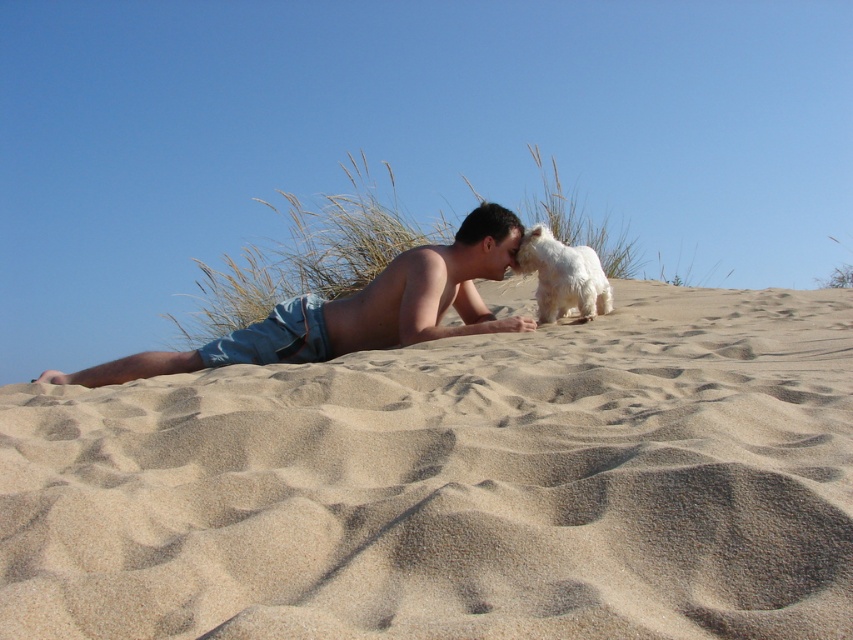
Does light beige sand at center have a lesser height compared to light blue denim shorts at center?

Indeed, light beige sand at center has a lesser height compared to light blue denim shorts at center.

Does light beige sand at center appear over light blue denim shorts at center?

No.

You are a GUI agent. You are given a task and a screenshot of the screen. Output one action in this format:
    pyautogui.click(x=<x>, y=<y>)
    Task: Click on the light beige sand at center
    This screenshot has height=640, width=853.
    Given the screenshot: What is the action you would take?
    pyautogui.click(x=454, y=484)

Identify the location of light beige sand at center. Image resolution: width=853 pixels, height=640 pixels. (454, 484).

Is light beige sand at center closer to camera compared to white fluffy dog at upper center?

Yes, light beige sand at center is closer to the viewer.

Who is more distant from viewer, (569, 429) or (561, 276)?

The point (561, 276) is behind.

Measure the distance between point (804,608) and camera.

Point (804,608) is 1.73 meters from camera.

You are a GUI agent. You are given a task and a screenshot of the screen. Output one action in this format:
    pyautogui.click(x=<x>, y=<y>)
    Task: Click on the light beige sand at center
    Image resolution: width=853 pixels, height=640 pixels.
    Given the screenshot: What is the action you would take?
    pyautogui.click(x=454, y=484)

Which is more to the left, light blue denim shorts at center or white fluffy dog at upper center?

light blue denim shorts at center is more to the left.

Is light blue denim shorts at center positioned in front of white fluffy dog at upper center?

Yes, it is in front of white fluffy dog at upper center.

This screenshot has height=640, width=853. What do you see at coordinates (357, 310) in the screenshot? I see `light blue denim shorts at center` at bounding box center [357, 310].

At what (x,y) coordinates should I click in order to perform the action: click on light blue denim shorts at center. Please return your answer as a coordinate pair (x, y). Looking at the image, I should click on pyautogui.click(x=357, y=310).